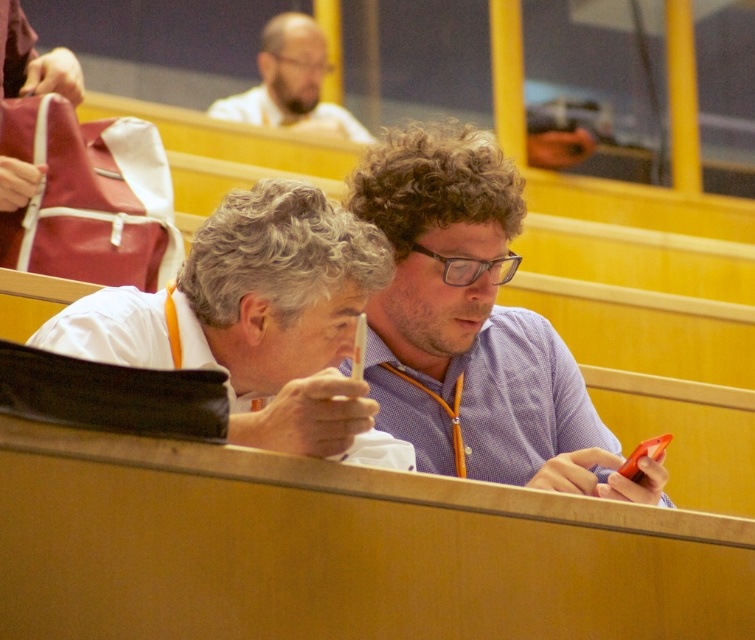
Question: Based on their relative distances, which object is farther from the white matte shirt at center?

Choices:
 (A) matte white shirt at upper center
 (B) purple checkered shirt at center

Answer: (A)

Question: Does purple checkered shirt at center appear on the left side of matte white shirt at upper center?

Choices:
 (A) no
 (B) yes

Answer: (A)

Question: Which of the following is the closest to the observer?

Choices:
 (A) (300, 220)
 (B) (421, 349)
 (C) (319, 122)

Answer: (A)

Question: Among these points, which one is farthest from the camera?

Choices:
 (A) (310, 353)
 (B) (441, 176)
 (C) (319, 65)

Answer: (C)

Question: Is purple checkered shirt at center smaller than matte white shirt at upper center?

Choices:
 (A) no
 (B) yes

Answer: (B)

Question: Does purple checkered shirt at center appear on the left side of white matte shirt at center?

Choices:
 (A) yes
 (B) no

Answer: (B)